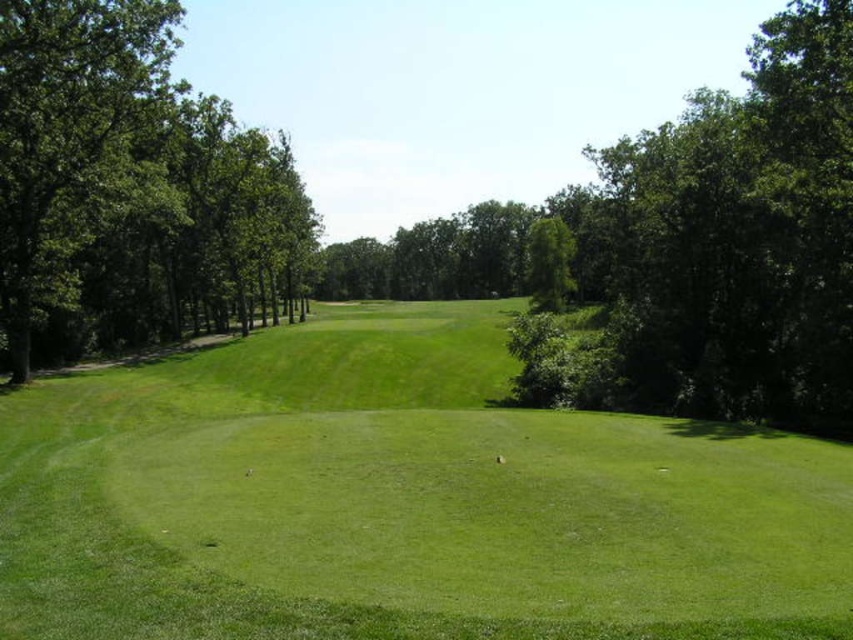
Question: Where is green grassy golf course at center located in relation to green leafy trees at left in the image?

Choices:
 (A) left
 (B) right

Answer: (B)

Question: From the image, what is the correct spatial relationship of green grassy golf course at center in relation to green leafy trees at left?

Choices:
 (A) above
 (B) below

Answer: (B)

Question: Does green grassy golf course at center come behind green leafy trees at left?

Choices:
 (A) no
 (B) yes

Answer: (A)

Question: Which of the following is the farthest from the observer?

Choices:
 (A) (656, 515)
 (B) (126, 189)

Answer: (B)